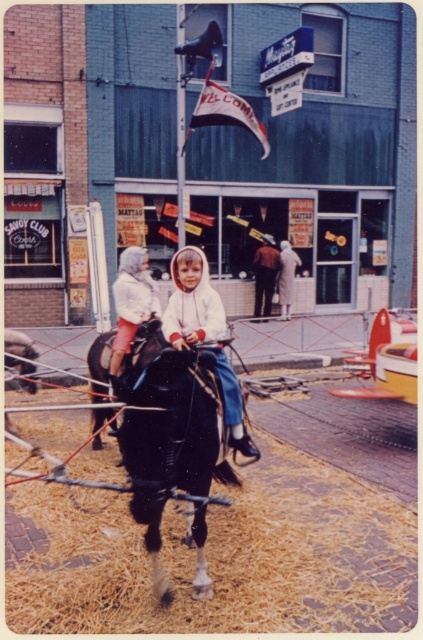
Which of these two, brown straw at lower center or dark brown leather jacket at center, stands shorter?

brown straw at lower center

Is brown straw at lower center below dark brown leather jacket at center?

Yes, brown straw at lower center is below dark brown leather jacket at center.

Is point (85, 616) more distant than point (257, 285)?

No, (85, 616) is closer to viewer.

This screenshot has width=423, height=640. Find the location of `brown straw at lower center`. brown straw at lower center is located at coordinates [x=222, y=557].

Is black glossy horse at center shorter than white cotton jacket at center?

In fact, black glossy horse at center may be taller than white cotton jacket at center.

The image size is (423, 640). What do you see at coordinates (175, 449) in the screenshot? I see `black glossy horse at center` at bounding box center [175, 449].

Is point (156, 422) behind point (151, 285)?

That is False.

You are a GUI agent. You are given a task and a screenshot of the screen. Output one action in this format:
    pyautogui.click(x=<x>, y=<y>)
    Task: Click on the black glossy horse at center
    Image resolution: width=423 pixels, height=640 pixels.
    Given the screenshot: What is the action you would take?
    pyautogui.click(x=175, y=449)

Does point (195, 253) come in front of point (280, 268)?

Yes, point (195, 253) is closer to viewer.

Find the location of a particular element. The width and height of the screenshot is (423, 640). white matte jacket at center is located at coordinates (192, 301).